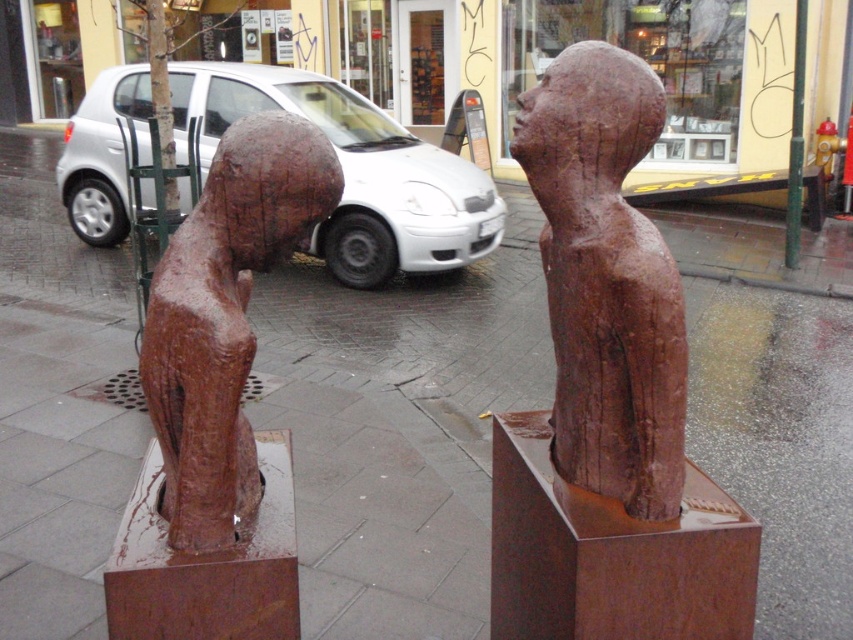
Question: Can you confirm if rusty wood statue at center is wider than rusty bronze statue at left?

Choices:
 (A) yes
 (B) no

Answer: (B)

Question: Can you confirm if rusty wood statue at center is positioned above rusty bronze statue at left?

Choices:
 (A) yes
 (B) no

Answer: (A)

Question: Which of these objects is positioned farthest from the silver metallic car at center?

Choices:
 (A) rusty wood statue at center
 (B) rusty bronze statue at left

Answer: (B)

Question: Which object is positioned closest to the rusty wood statue at center?

Choices:
 (A) rusty bronze statue at left
 (B) silver metallic car at center

Answer: (A)

Question: In this image, where is rusty wood statue at center located relative to silver metallic car at center?

Choices:
 (A) right
 (B) left

Answer: (A)

Question: Which is farther from the rusty bronze statue at left?

Choices:
 (A) silver metallic car at center
 (B) rusty wood statue at center

Answer: (A)